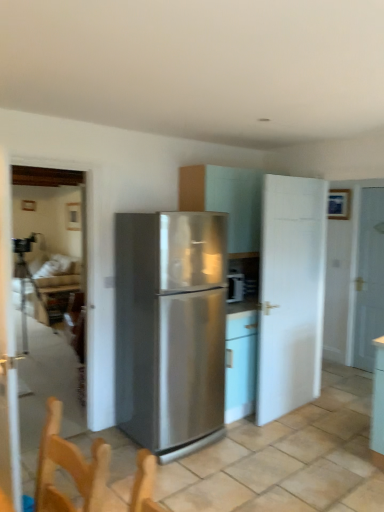
Find the location of `free space above clear glass door at left, which ranks as the 2th glass door in front-to-back order (from a real-world perspective)`. free space above clear glass door at left, which ranks as the 2th glass door in front-to-back order (from a real-world perspective) is located at coordinates (49, 153).